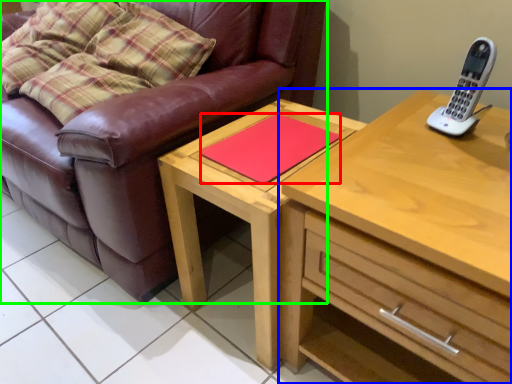
Question: Which object is positioned farthest from pad (highlighted by a red box)? Select from chest of drawers (highlighted by a blue box) and studio couch (highlighted by a green box).

Choices:
 (A) chest of drawers
 (B) studio couch

Answer: (B)